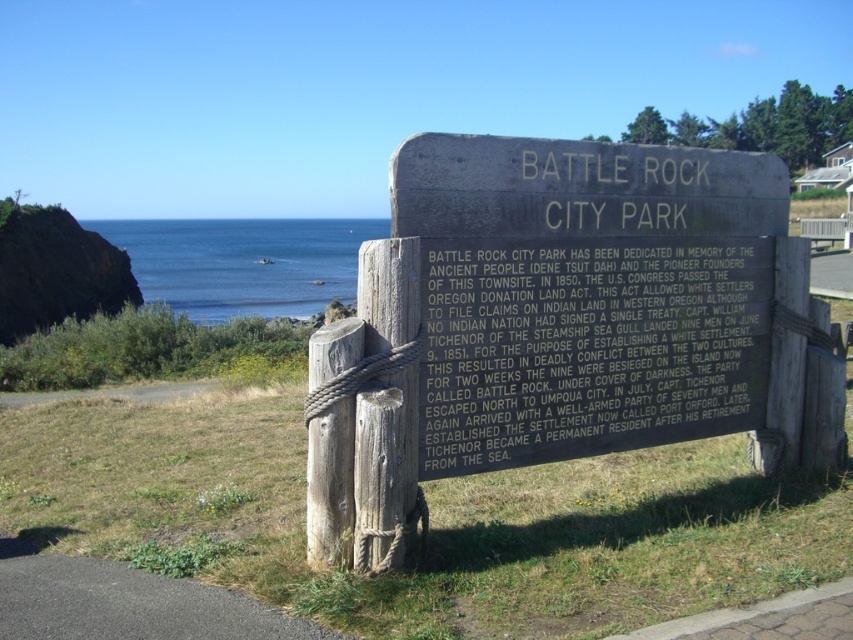
You are a visitor at Battle Rock City Park and want to take a photo of the black polished stone plaque at center and the blue water at center. Which object should you focus on first to ensure both are in the frame?

You should focus on the black polished stone plaque at center first since it is in front of the blue water at center, ensuring both are in the frame by starting with the closer object.